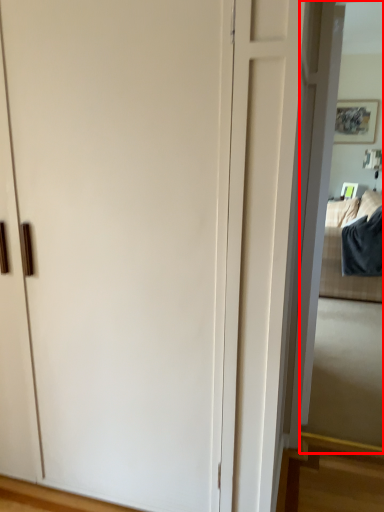
Question: From the image's perspective, considering the relative positions of mirror (annotated by the red box) and bedding in the image provided, where is mirror (annotated by the red box) located with respect to the staircase?

Choices:
 (A) above
 (B) below

Answer: (B)